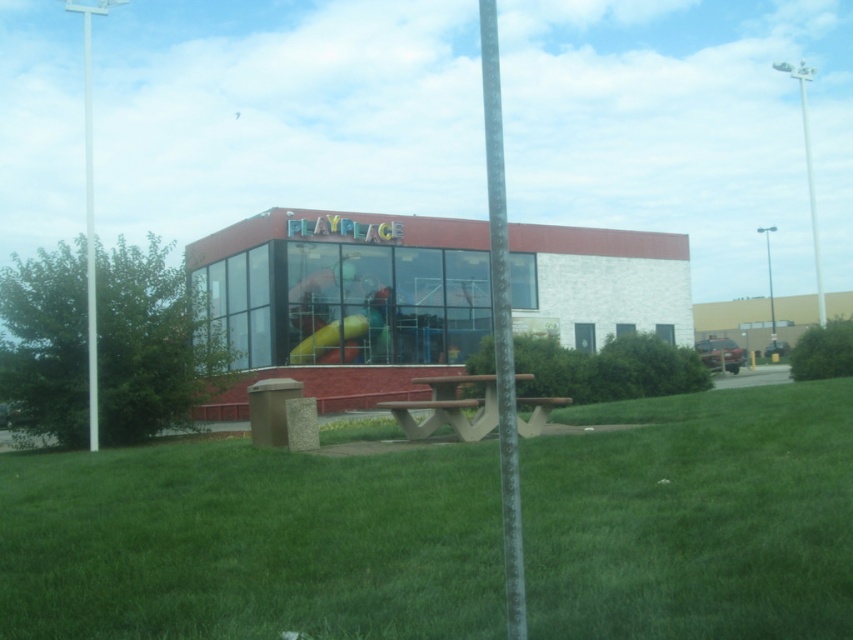
Can you confirm if white metallic pole at upper right is wider than yellow rubber slide at center?

Correct, the width of white metallic pole at upper right exceeds that of yellow rubber slide at center.

Can you confirm if white metallic pole at upper right is positioned to the right of yellow rubber slide at center?

Yes, white metallic pole at upper right is to the right of yellow rubber slide at center.

Identify the location of white metallic pole at upper right. (810, 182).

Can you confirm if brown wood park bench at center is smaller than yellow rubber slide at center?

Indeed, brown wood park bench at center has a smaller size compared to yellow rubber slide at center.

Is brown wood park bench at center in front of yellow rubber slide at center?

Yes, it is.

Measure the distance between brown wood park bench at center and camera.

brown wood park bench at center is 12.29 meters from camera.

This screenshot has height=640, width=853. Find the location of `brown wood park bench at center`. brown wood park bench at center is located at coordinates (437, 417).

Where is `metallic pole at center`? This screenshot has height=640, width=853. metallic pole at center is located at coordinates (502, 324).

Can you confirm if metallic pole at center is positioned to the left of white metallic pole at upper right?

Correct, you'll find metallic pole at center to the left of white metallic pole at upper right.

Locate an element on the screen. metallic pole at center is located at coordinates (502, 324).

Identify the location of metallic pole at center. This screenshot has width=853, height=640. (502, 324).